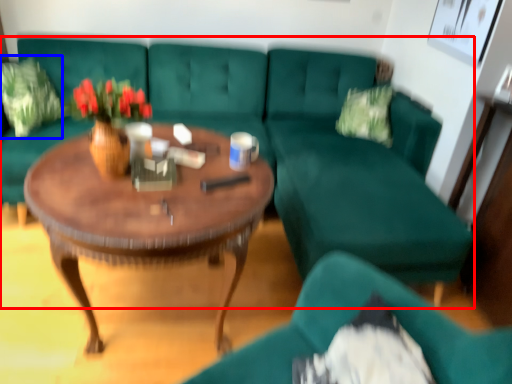
Question: Which of the following is the farthest to the observer, studio couch (highlighted by a red box) or pillow (highlighted by a blue box)?

Choices:
 (A) studio couch
 (B) pillow

Answer: (B)